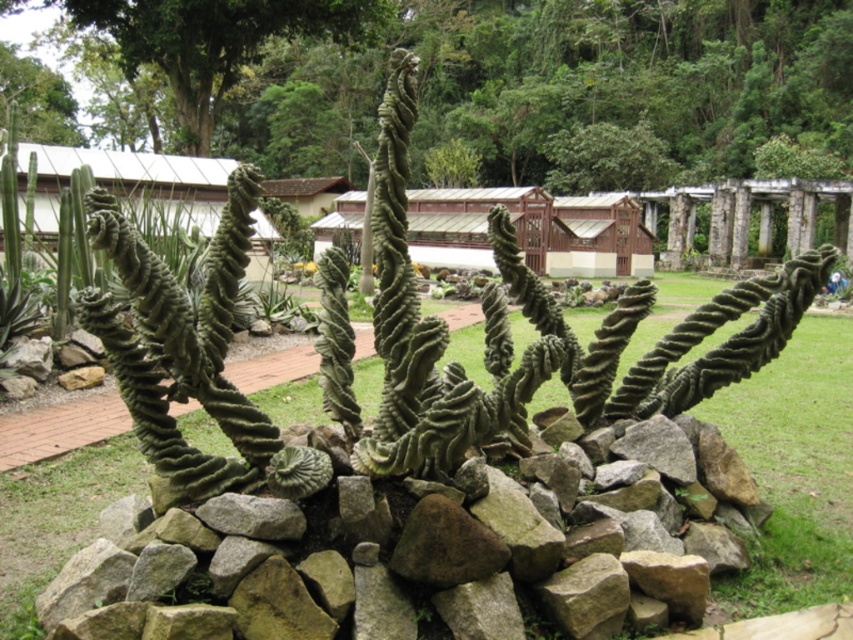
You are standing in the botanical garden and want to take a photo of the green grass at center and the green leafy tree at upper left. Which object should you focus on first if you want to capture both in the same frame without moving the camera?

→ The green grass at center is located below the green leafy tree at upper left, so you should focus on the green leafy tree at upper left first to ensure both are in the frame.

You are a landscape architect designing a garden layout. You need to place a large sculpture that requires space equal to the area covered by the green textured tree at upper center. Can the green leafy tree at upper left accommodate the sculpture instead?

The green textured tree at upper center is larger than the green leafy tree at upper left, so the sculpture requiring the space of the larger tree cannot be accommodated by the smaller green leafy tree at upper left.

In the scene shown: You are standing in the botanical garden and want to take a photo of the green grass at center and the green leafy tree at upper left. From your current position, which object is more to the left?

The green leafy tree at upper left is more to the left since the green grass at center is positioned on the right side of it.